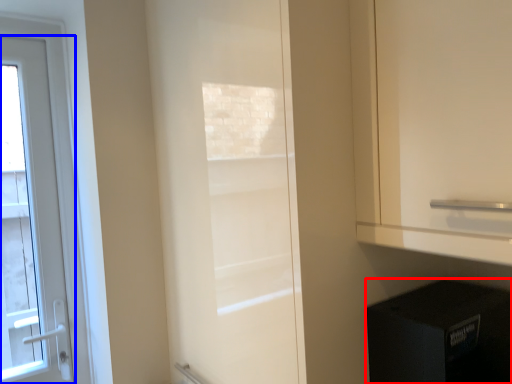
Question: Which of the following is the closest to the observer, appliance (highlighted by a red box) or door (highlighted by a blue box)?

Choices:
 (A) appliance
 (B) door

Answer: (A)